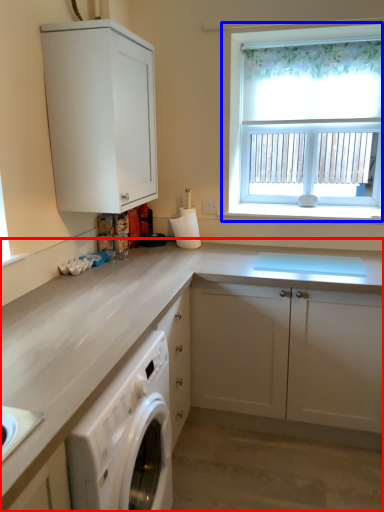
Question: Which point is further to the camera, cabinetry (highlighted by a red box) or window (highlighted by a blue box)?

Choices:
 (A) cabinetry
 (B) window

Answer: (B)